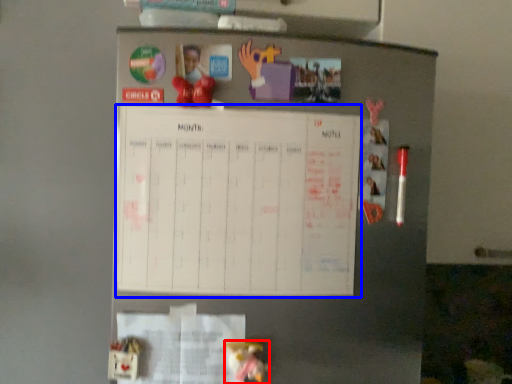
Question: Which point is closer to the camera, toy (highlighted by a red box) or bulletin board (highlighted by a blue box)?

Choices:
 (A) toy
 (B) bulletin board

Answer: (A)